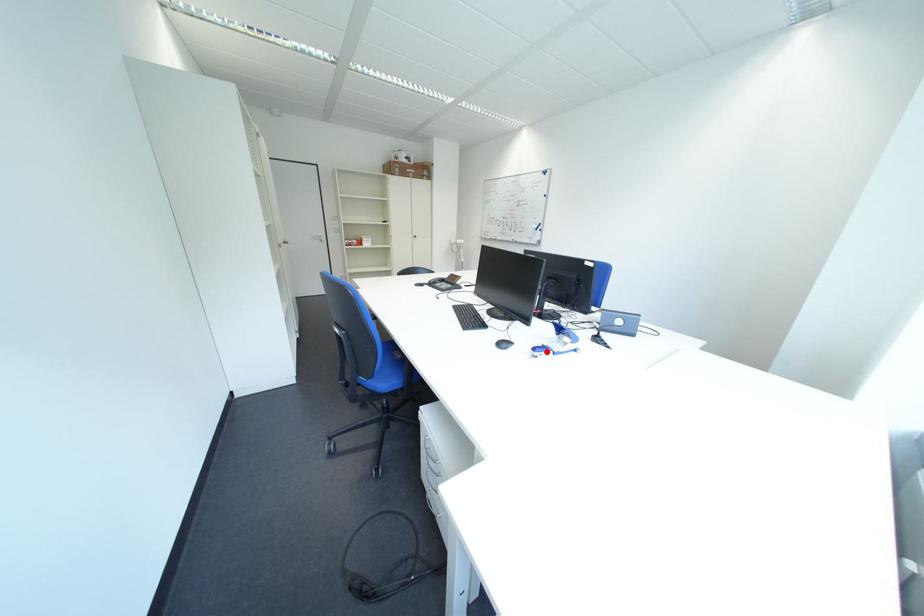
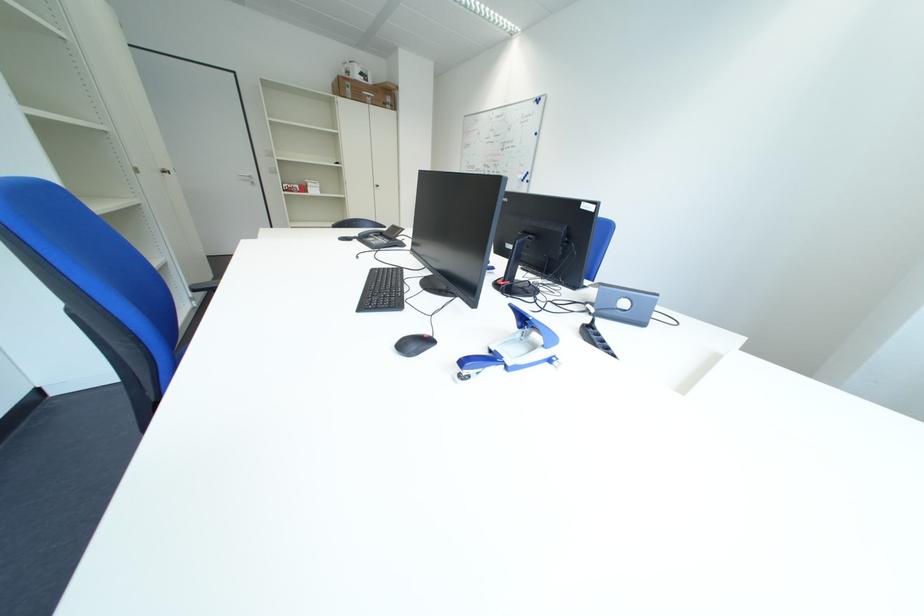
The point at the highlighted location is marked in the first image. Where is the corresponding point in the second image?

(475, 365)